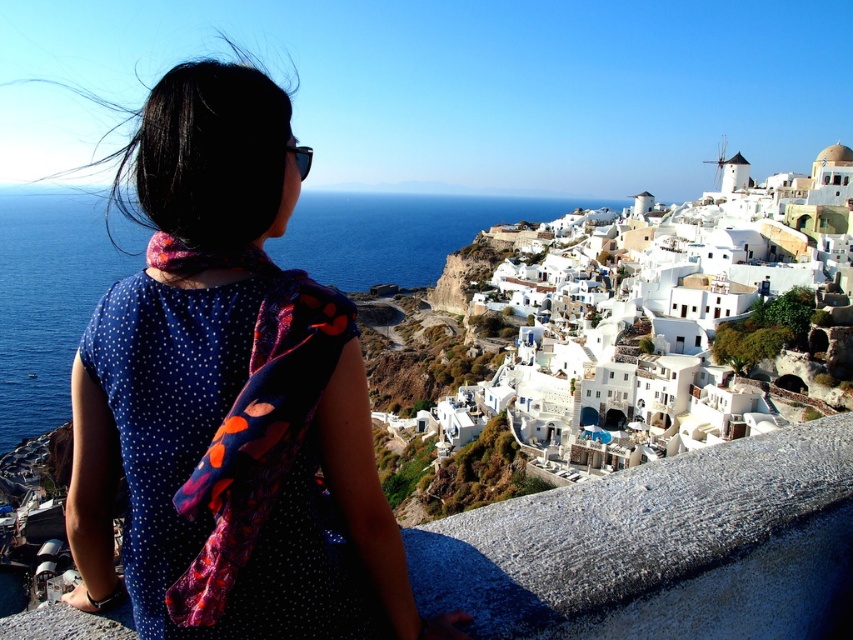
You are a fashion designer observing two dresses in the coastal scene. The blue dotted dress at center and the blue dotted fabric dress at upper left. Which one is larger in size?

The blue dotted dress at center is bigger than the blue dotted fabric dress at upper left.

You are standing at the stone ledge in the coastal scene and looking towards the sea. Where exactly are the white stucco buildings at upper right located in the image?

The white stucco buildings at upper right are located at the coordinates point (656, 321) in the image.

You are a photographer trying to capture the best shot of the blue dotted dress at center and the blue dotted fabric dress at upper left. Which dress should you focus on to ensure it appears taller in the photo?

The blue dotted dress at center should be focused on because it has a greater height compared to the blue dotted fabric dress at upper left, making it appear taller in the photo.